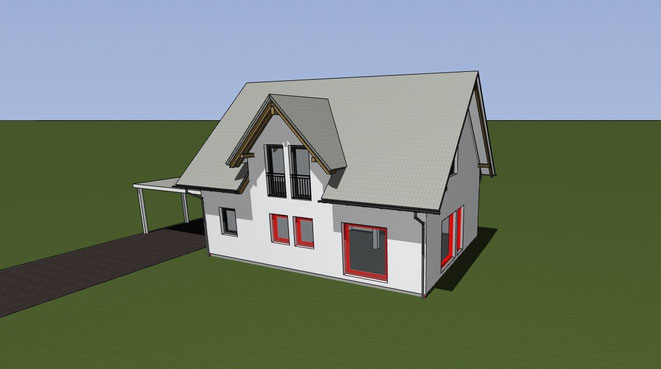
At what (x,y) coordinates should I click in order to perform the action: click on frame. Please return your answer as a coordinate pair (x, y). Looking at the image, I should click on (273, 184), (299, 181).